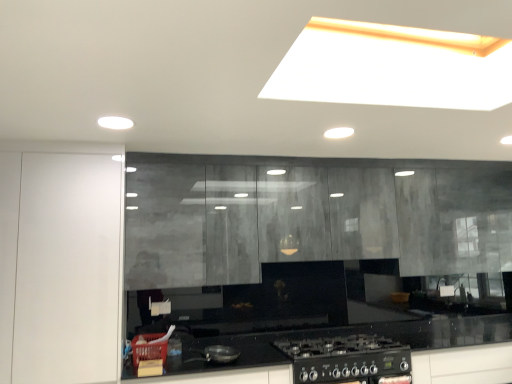
Question: In terms of height, does white glossy cabinet at left look taller or shorter compared to matte concrete cabinets at center?

Choices:
 (A) tall
 (B) short

Answer: (A)

Question: Does point (104, 251) appear closer or farther from the camera than point (248, 281)?

Choices:
 (A) farther
 (B) closer

Answer: (B)

Question: Which is correct: white glossy cabinet at left is inside matte concrete cabinets at center, or outside of it?

Choices:
 (A) outside
 (B) inside

Answer: (A)

Question: In terms of height, does matte concrete cabinets at center look taller or shorter compared to white glossy cabinet at left?

Choices:
 (A) short
 (B) tall

Answer: (A)

Question: Considering the positions of point (490, 259) and point (50, 178), is point (490, 259) closer or farther from the camera than point (50, 178)?

Choices:
 (A) closer
 (B) farther

Answer: (B)

Question: Considering the positions of matte concrete cabinets at center and white glossy cabinet at left in the image, is matte concrete cabinets at center wider or thinner than white glossy cabinet at left?

Choices:
 (A) wide
 (B) thin

Answer: (B)

Question: From the image's perspective, is matte concrete cabinets at center located above or below white glossy cabinet at left?

Choices:
 (A) below
 (B) above

Answer: (B)